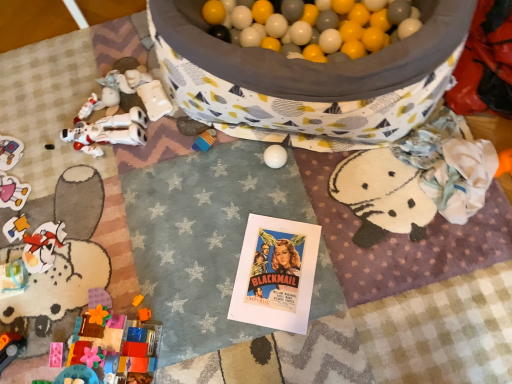
Question: Does orange plastic car at lower left, positioned as the fourth toy in top-to-bottom order, have a lesser width compared to white matte robot at left, the third toy positioned from the front?

Choices:
 (A) yes
 (B) no

Answer: (A)

Question: Considering the relative positions of orange plastic car at lower left, positioned as the fourth toy in top-to-bottom order, and white matte robot at left, which is the first toy in top-to-bottom order, in the image provided, is orange plastic car at lower left, positioned as the fourth toy in top-to-bottom order, to the left of white matte robot at left, which is the first toy in top-to-bottom order, from the viewer's perspective?

Choices:
 (A) no
 (B) yes

Answer: (B)

Question: Does orange plastic car at lower left, which ranks as the 1th toy in bottom-to-top order, turn towards white matte robot at left, acting as the second toy starting from the back?

Choices:
 (A) no
 (B) yes

Answer: (A)

Question: Is orange plastic car at lower left, the 3th toy from the back, behind white matte robot at left, the fourth toy positioned from the bottom?

Choices:
 (A) no
 (B) yes

Answer: (A)

Question: Is orange plastic car at lower left, the 2th toy viewed from the front, surrounding white matte robot at left, acting as the second toy starting from the back?

Choices:
 (A) yes
 (B) no

Answer: (B)

Question: From a real-world perspective, is orange plastic car at lower left, which ranks as the 1th toy in bottom-to-top order, physically located above or below plastic toy car at lower left, the 1th toy positioned from the back?

Choices:
 (A) below
 (B) above

Answer: (B)

Question: In the image, is orange plastic car at lower left, the 2th toy viewed from the front, positioned in front of or behind plastic toy car at lower left, the 1th toy positioned from the back?

Choices:
 (A) front
 (B) behind

Answer: (A)

Question: Looking at their shapes, would you say orange plastic car at lower left, the 3th toy from the back, is wider or thinner than plastic toy car at lower left, the 1th toy positioned from the back?

Choices:
 (A) thin
 (B) wide

Answer: (A)

Question: From the image's perspective, relative to plastic toy car at lower left, which ranks as the 3th toy in bottom-to-top order, is orange plastic car at lower left, the 2th toy viewed from the front, above or below?

Choices:
 (A) below
 (B) above

Answer: (A)

Question: Considering the positions of brick-like plastic blocks at lower left, arranged as the first toy when viewed from the front, and orange plastic car at lower left, the 3th toy from the back, in the image, is brick-like plastic blocks at lower left, arranged as the first toy when viewed from the front, wider or thinner than orange plastic car at lower left, the 3th toy from the back,?

Choices:
 (A) thin
 (B) wide

Answer: (B)

Question: From a real-world perspective, is brick-like plastic blocks at lower left, placed as the third toy when sorted from top to bottom, positioned above or below orange plastic car at lower left, the 3th toy from the back?

Choices:
 (A) above
 (B) below

Answer: (A)

Question: Do you think brick-like plastic blocks at lower left, placed as the third toy when sorted from top to bottom, is within orange plastic car at lower left, positioned as the fourth toy in top-to-bottom order, or outside of it?

Choices:
 (A) outside
 (B) inside

Answer: (A)

Question: From the image's perspective, relative to orange plastic car at lower left, positioned as the fourth toy in top-to-bottom order, is brick-like plastic blocks at lower left, arranged as the first toy when viewed from the front, above or below?

Choices:
 (A) below
 (B) above

Answer: (B)

Question: Looking at the image, does brick-like plastic blocks at lower left, which is counted as the 2th toy, starting from the bottom, seem bigger or smaller compared to plastic toy car at lower left, which is counted as the 2th toy, starting from the top?

Choices:
 (A) big
 (B) small

Answer: (A)

Question: In terms of height, does brick-like plastic blocks at lower left, arranged as the first toy when viewed from the front, look taller or shorter compared to plastic toy car at lower left, which ranks as the 3th toy in bottom-to-top order?

Choices:
 (A) short
 (B) tall

Answer: (B)